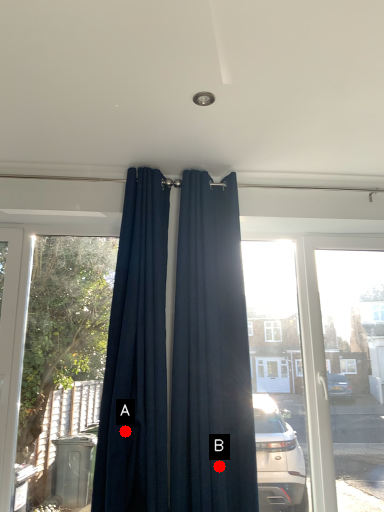
Question: Two points are circled on the image, labeled by A and B beside each circle. Which of the following is the farthest from the observer?

Choices:
 (A) A is further
 (B) B is further

Answer: (B)